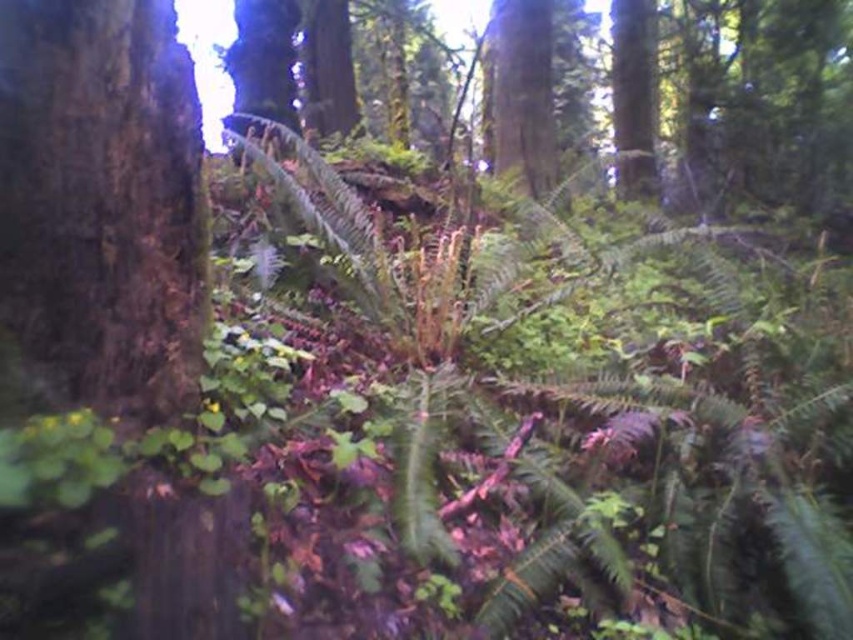
You are a hiker carrying a 15 feet long rope. You want to tie the dark brown rough bark at left to the smooth bark tree trunk at upper center. Is your rope long enough?

The distance between dark brown rough bark at left and smooth bark tree trunk at upper center is 17.60 feet. Since the rope is only 15 feet long, it is not long enough to reach between them.

You are a hiker trying to identify two trees in the forest. You see the smooth bark tree trunk at upper center and the green rough bark tree at upper right. Which tree has a smaller trunk?

The smooth bark tree trunk at upper center is smaller than the green rough bark tree at upper right.

Consider the image. You are navigating through the forest and need to identify the position of the dark brown rough bark at left. What are its coordinates?

The dark brown rough bark at left is located at point (x=99, y=208).